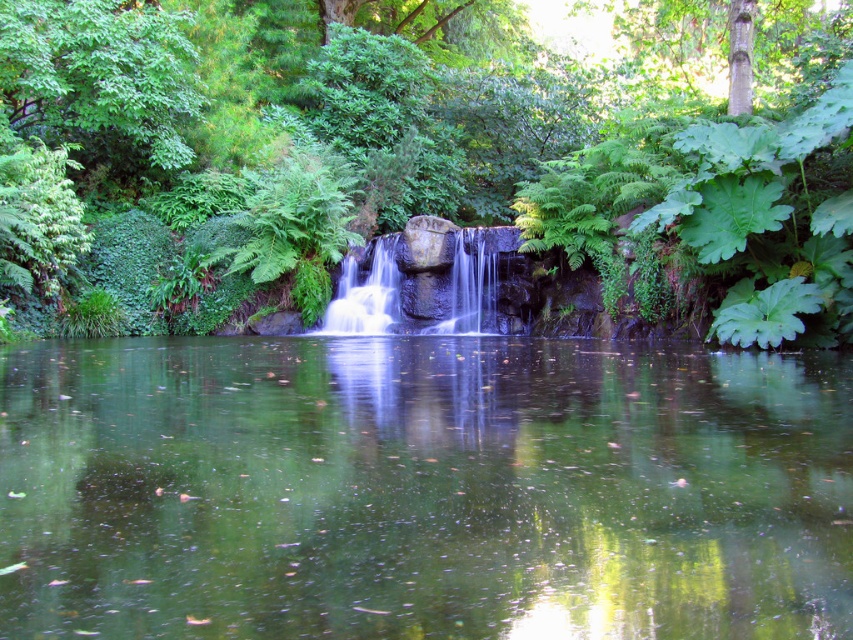
You are standing at the edge of the pond in the serene natural scene. You notice two points marked in the image. Which point, point (111, 438) or point (519, 204), is closer to you?

Point (111, 438) is closer to the viewer than point (519, 204).

You are standing at the point marked as point (738, 602) in the scene. You want to walk to the edge of the pond to collect a leaf. The pond is 10 feet away from your current position. Can you reach the edge of the pond without walking more than 6.62 feet?

The distance between you and the viewer is 6.62 feet. Since the pond is 10 feet away from your current position, you would need to walk 10 feet to reach it, which exceeds the 6.62 feet limit. Therefore, you cannot reach the edge of the pond without walking more than 6.62 feet.